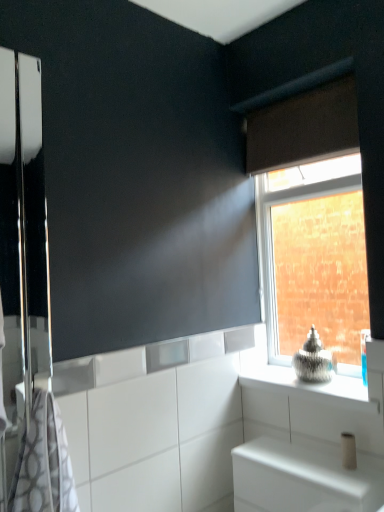
This screenshot has width=384, height=512. What do you see at coordinates (43, 462) in the screenshot? I see `gray-patterned towel at left` at bounding box center [43, 462].

What is the approximate height of clear glass window at upper right?

clear glass window at upper right is 35.24 inches tall.

Measure the distance between point (358, 368) and camera.

Point (358, 368) is 2.02 meters away from camera.

Describe the element at coordinates (23, 225) in the screenshot. Image resolution: width=384 pixels, height=512 pixels. I see `polished chrome screen door at left` at that location.

Locate an element on the screen. This screenshot has width=384, height=512. polished chrome screen door at left is located at coordinates (23, 225).

Describe the element at coordinates (308, 387) in the screenshot. I see `metallic silver vase at upper right` at that location.

At what (x,y) coordinates should I click in order to perform the action: click on metallic silver vase at upper right. Please return your answer as a coordinate pair (x, y). This screenshot has width=384, height=512. Looking at the image, I should click on (308, 387).

What is the approximate height of brown fabric curtain at upper right?

11.74 inches.

Measure the distance between white glossy cabinet at lower right and camera.

white glossy cabinet at lower right is 4.08 feet from camera.

Image resolution: width=384 pixels, height=512 pixels. What do you see at coordinates (303, 478) in the screenshot?
I see `white glossy cabinet at lower right` at bounding box center [303, 478].

The image size is (384, 512). Identify the location of white matte toilet paper at lower right. (348, 451).

What do you see at coordinates (348, 451) in the screenshot?
I see `white matte toilet paper at lower right` at bounding box center [348, 451].

Identify the location of gray-patterned towel at left. (43, 462).

Is white glossy cabinet at lower right at the back of gray-patterned towel at left?

No, gray-patterned towel at left is not facing the opposite direction of white glossy cabinet at lower right.

Does gray-patterned towel at left have a lesser height compared to white glossy cabinet at lower right?

In fact, gray-patterned towel at left may be taller than white glossy cabinet at lower right.

You are a GUI agent. You are given a task and a screenshot of the screen. Output one action in this format:
    pyautogui.click(x=<x>, y=<y>)
    Task: Click on the cabinetry in front of the gray-patterned towel at left
    The height and width of the screenshot is (512, 384).
    Given the screenshot: What is the action you would take?
    pyautogui.click(x=303, y=478)

Which is correct: gray-patterned towel at left is inside white glossy cabinet at lower right, or outside of it?

gray-patterned towel at left lies outside white glossy cabinet at lower right.

Looking at this image, are metallic silver vase at upper right and white matte toilet paper at lower right located far from each other?

Actually, metallic silver vase at upper right and white matte toilet paper at lower right are a little close together.

From the image's perspective, between metallic silver vase at upper right and white matte toilet paper at lower right, which one is located above?

metallic silver vase at upper right appears higher in the image.

From a real-world perspective, which object rests below the other?

In real-world perspective, white matte toilet paper at lower right is lower.

Is point (245, 384) positioned after point (341, 447)?

Yes.

Considering the sizes of gray-patterned towel at left and clear glass window at upper right in the image, is gray-patterned towel at left bigger or smaller than clear glass window at upper right?

Clearly, gray-patterned towel at left is smaller in size than clear glass window at upper right.

Can you confirm if gray-patterned towel at left is positioned to the right of clear glass window at upper right?

In fact, gray-patterned towel at left is to the left of clear glass window at upper right.

You are a GUI agent. You are given a task and a screenshot of the screen. Output one action in this format:
    pyautogui.click(x=<x>, y=<y>)
    Task: Click on the window that is above the gray-patterned towel at left (from the image's perspective)
    The image size is (384, 512).
    Given the screenshot: What is the action you would take?
    pyautogui.click(x=300, y=159)

Can you confirm if gray-patterned towel at left is shorter than clear glass window at upper right?

Correct, gray-patterned towel at left is not as tall as clear glass window at upper right.

In the scene shown: Does metallic silver vase at upper right have a greater height compared to brown fabric curtain at upper right?

No, metallic silver vase at upper right is not taller than brown fabric curtain at upper right.

Can you tell me how much metallic silver vase at upper right and brown fabric curtain at upper right differ in facing direction?

0.817 degrees.

Does metallic silver vase at upper right appear on the right side of brown fabric curtain at upper right?

Yes.

From a real-world perspective, which object rests below the other?

From a 3D spatial view, metallic silver vase at upper right is below.

Considering the sizes of objects gray-patterned towel at left and white matte toilet paper at lower right in the image provided, who is bigger, gray-patterned towel at left or white matte toilet paper at lower right?

gray-patterned towel at left.

How distant is gray-patterned towel at left from white matte toilet paper at lower right?

They are 37.89 inches apart.

How many degrees apart are the facing directions of gray-patterned towel at left and white matte toilet paper at lower right?

The facing directions of gray-patterned towel at left and white matte toilet paper at lower right are 89.8 degrees apart.

Is there a large distance between gray-patterned towel at left and white matte toilet paper at lower right?

Actually, gray-patterned towel at left and white matte toilet paper at lower right are a little close together.

Is metallic silver vase at upper right to the left of white glossy cabinet at lower right from the viewer's perspective?

In fact, metallic silver vase at upper right is to the right of white glossy cabinet at lower right.

Between point (328, 394) and point (310, 462), which one is positioned in front?

Positioned in front is point (310, 462).

Between metallic silver vase at upper right and white glossy cabinet at lower right, which one has larger width?

With larger width is white glossy cabinet at lower right.

Is metallic silver vase at upper right further to the viewer compared to white glossy cabinet at lower right?

Yes, it is.

From the image's perspective, which is above, metallic silver vase at upper right or polished chrome screen door at left?

polished chrome screen door at left.

From a real-world perspective, is metallic silver vase at upper right physically above polished chrome screen door at left?

No, from a real-world perspective, metallic silver vase at upper right is not on top of polished chrome screen door at left.

Looking at their sizes, would you say metallic silver vase at upper right is wider or thinner than polished chrome screen door at left?

In the image, metallic silver vase at upper right appears to be wider than polished chrome screen door at left.

Identify the location of screen door above the metallic silver vase at upper right (from a real-world perspective). The width and height of the screenshot is (384, 512). (23, 225).

Where is `cabinetry that appears on the right of gray-patterned towel at left`? cabinetry that appears on the right of gray-patterned towel at left is located at coordinates (303, 478).

Image resolution: width=384 pixels, height=512 pixels. Find the location of `toilet paper lying in front of the metallic silver vase at upper right`. toilet paper lying in front of the metallic silver vase at upper right is located at coordinates (348, 451).

Which object lies nearer to the anchor point clear glass window at upper right, gray-patterned towel at left or polished chrome screen door at left?

Among the two, polished chrome screen door at left is located nearer to clear glass window at upper right.

Which object lies further to the anchor point clear glass window at upper right, brown fabric curtain at upper right or white matte toilet paper at lower right?

Based on the image, white matte toilet paper at lower right appears to be further to clear glass window at upper right.

Looking at the image, which one is located closer to white glossy cabinet at lower right, white matte toilet paper at lower right or polished chrome screen door at left?

Based on the image, white matte toilet paper at lower right appears to be nearer to white glossy cabinet at lower right.

Considering their positions, is polished chrome screen door at left positioned further to gray-patterned towel at left than metallic silver vase at upper right?

Among the two, metallic silver vase at upper right is located further to gray-patterned towel at left.

Looking at the image, which one is located closer to clear glass window at upper right, white glossy cabinet at lower right or gray-patterned towel at left?

white glossy cabinet at lower right.

In the scene shown: Estimate the real-world distances between objects in this image. Which object is further from clear glass window at upper right, metallic silver vase at upper right or gray-patterned towel at left?

Result: gray-patterned towel at left lies further to clear glass window at upper right than the other object.

Based on their spatial positions, is polished chrome screen door at left or clear glass window at upper right closer to metallic silver vase at upper right?

clear glass window at upper right lies closer to metallic silver vase at upper right than the other object.

Based on their spatial positions, is polished chrome screen door at left or metallic silver vase at upper right closer to clear glass window at upper right?

The object closer to clear glass window at upper right is metallic silver vase at upper right.

At what (x,y) coordinates should I click in order to perform the action: click on window sill located between polished chrome screen door at left and white matte toilet paper at lower right in the left-right direction. Please return your answer as a coordinate pair (x, y). The image size is (384, 512). Looking at the image, I should click on (308, 387).

Image resolution: width=384 pixels, height=512 pixels. In order to click on bath towel between polished chrome screen door at left and white glossy cabinet at lower right in the vertical direction in this screenshot , I will do `click(43, 462)`.

The width and height of the screenshot is (384, 512). In order to click on window sill between gray-patterned towel at left and clear glass window at upper right in the horizontal direction in this screenshot , I will do `click(308, 387)`.

At what (x,y) coordinates should I click in order to perform the action: click on window sill between clear glass window at upper right and white matte toilet paper at lower right in the up-down direction. Please return your answer as a coordinate pair (x, y). This screenshot has width=384, height=512. Looking at the image, I should click on (308, 387).